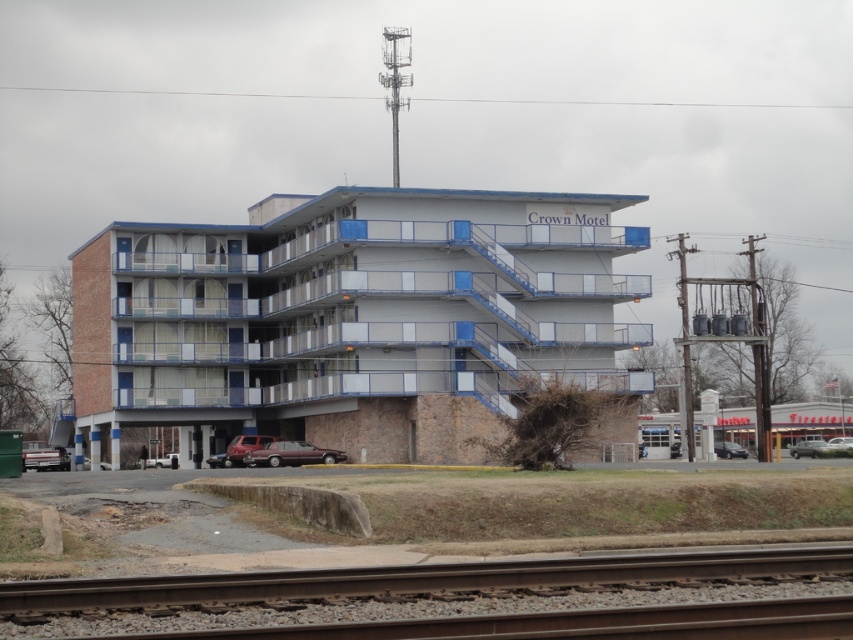
Is metallic maroon sedan at center further to the viewer compared to dark gray metallic sedan at lower right?

No, it is not.

Which is below, metallic maroon sedan at center or dark gray metallic sedan at lower right?

dark gray metallic sedan at lower right is below.

What do you see at coordinates (238, 451) in the screenshot? The height and width of the screenshot is (640, 853). I see `metallic maroon sedan at center` at bounding box center [238, 451].

The width and height of the screenshot is (853, 640). What are the coordinates of `metallic maroon sedan at center` in the screenshot? It's located at (238, 451).

Does metallic maroon sedan at center appear on the left side of metallic silver sedan at lower right?

Indeed, metallic maroon sedan at center is positioned on the left side of metallic silver sedan at lower right.

Which of these two, metallic maroon sedan at center or metallic silver sedan at lower right, stands taller?

metallic maroon sedan at center is taller.

Describe the element at coordinates (238, 451) in the screenshot. I see `metallic maroon sedan at center` at that location.

Identify the location of metallic maroon sedan at center. pos(238,451).

Does maroon metallic sedan at center lie behind dark gray metallic sedan at lower right?

No, maroon metallic sedan at center is closer to the viewer.

Who is more forward, (285, 452) or (734, 456)?

Point (285, 452) is in front.

Locate an element on the screen. This screenshot has height=640, width=853. maroon metallic sedan at center is located at coordinates (291, 454).